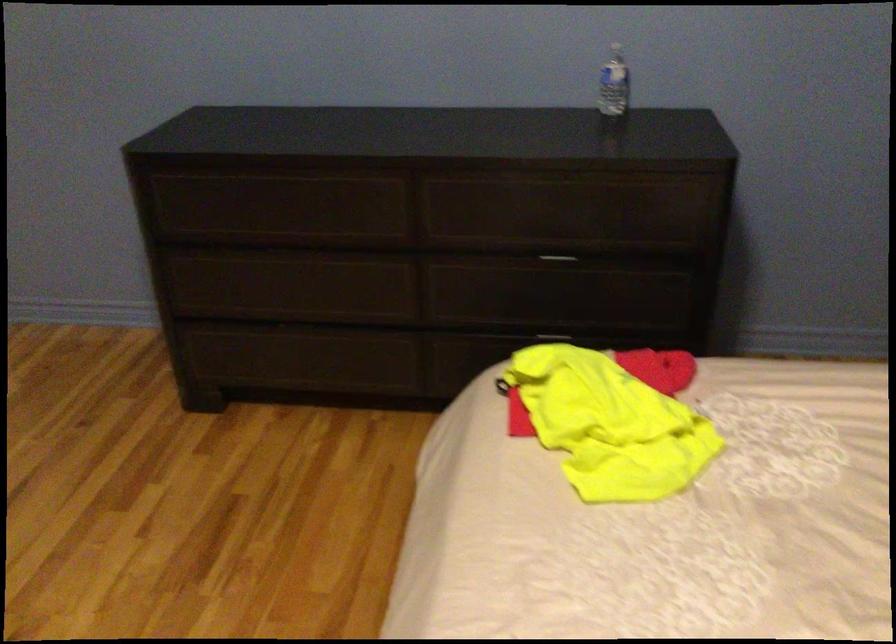
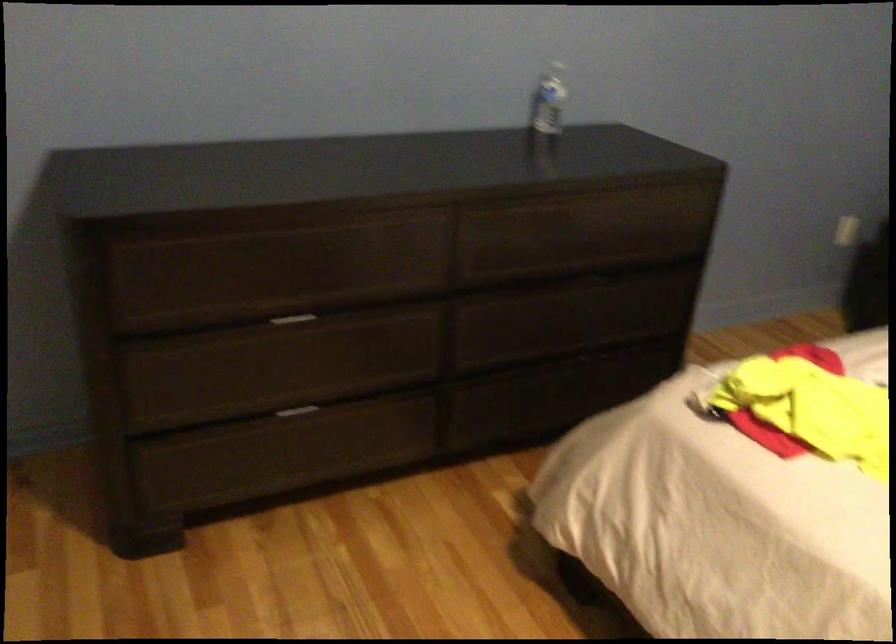
The point at (288, 252) is marked in the first image. Where is the corresponding point in the second image?

(291, 319)